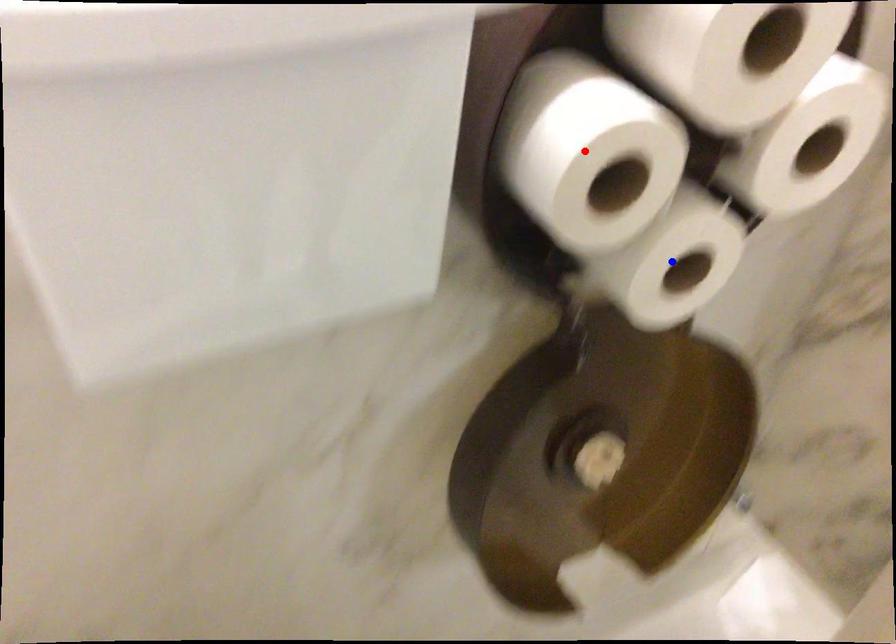
Question: In the image, two points are highlighted. Which point is nearer to the camera? Reply with the corresponding letter.

Choices:
 (A) blue point
 (B) red point

Answer: (B)